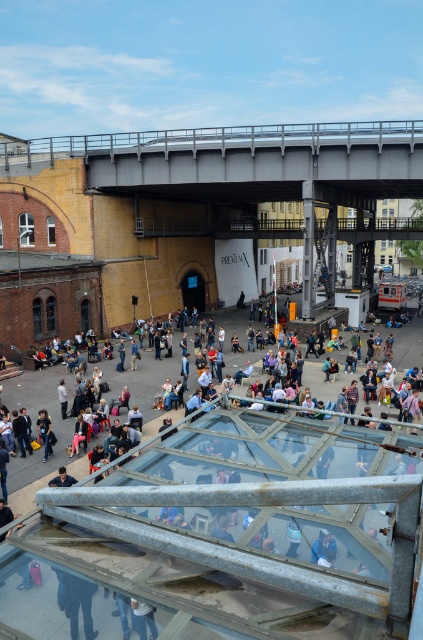
Who is lower down, matte black jacket at center or gray metallic bridge at upper center?

Positioned lower is matte black jacket at center.

Who is positioned more to the left, matte black jacket at center or gray metallic bridge at upper center?

From the viewer's perspective, matte black jacket at center appears more on the left side.

Which is behind, point (79, 499) or point (143, 173)?

The point (143, 173) is more distant.

In order to click on matte black jacket at center in this screenshot , I will do `click(228, 531)`.